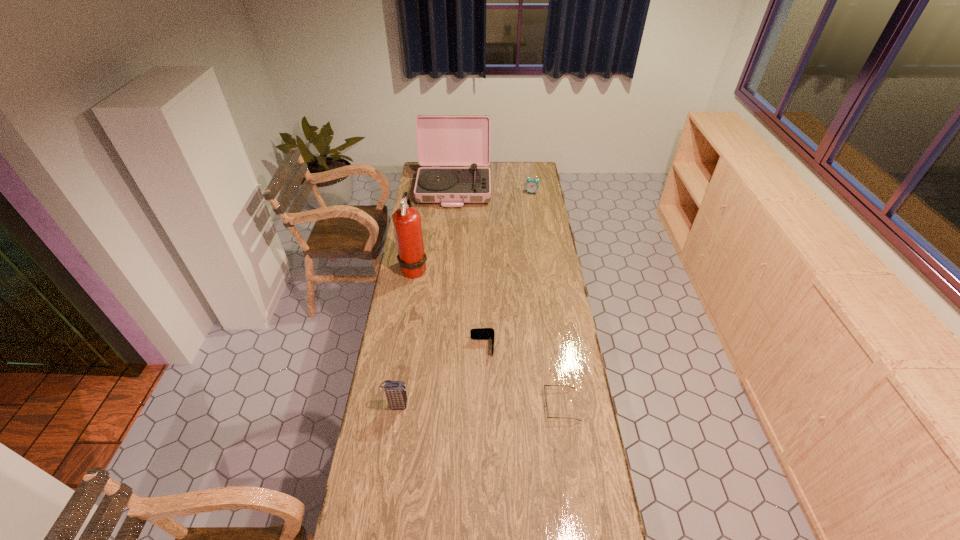
You are a GUI agent. You are given a task and a screenshot of the screen. Output one action in this format:
    pyautogui.click(x=<x>, y=<y>)
    Task: Click on the vacant position located 0.350m with the zip open on the clutch bag
    The width and height of the screenshot is (960, 540).
    Given the screenshot: What is the action you would take?
    pyautogui.click(x=506, y=405)

Image resolution: width=960 pixels, height=540 pixels. Identify the location of free space located on the face of the third shortest object. (534, 204).

Identify the location of vacant space located on the outer surface of the second shortest object. The height and width of the screenshot is (540, 960). (441, 347).

Find the location of a particular element. vacant space situated on the outer surface of the second shortest object is located at coordinates (398, 347).

Where is `vacant area situated 0.080m on the outer surface of the second shortest object`? vacant area situated 0.080m on the outer surface of the second shortest object is located at coordinates (450, 347).

Where is `vacant area situated 0.070m on the front-facing side of the shortest object`? Image resolution: width=960 pixels, height=540 pixels. vacant area situated 0.070m on the front-facing side of the shortest object is located at coordinates (526, 404).

The image size is (960, 540). I want to click on free spot located 0.070m on the front-facing side of the shortest object, so click(x=526, y=404).

Find the location of a particular element. Image resolution: width=960 pixels, height=540 pixels. free spot located 0.200m on the front-facing side of the shortest object is located at coordinates (491, 404).

Locate an element on the screen. The height and width of the screenshot is (540, 960). object that is at the far edge is located at coordinates (442, 140).

You are a GUI agent. You are given a task and a screenshot of the screen. Output one action in this format:
    pyautogui.click(x=<x>, y=<y>)
    Task: Click on the fire extinguisher present at the left edge
    
    Given the screenshot: What is the action you would take?
    pyautogui.click(x=412, y=259)